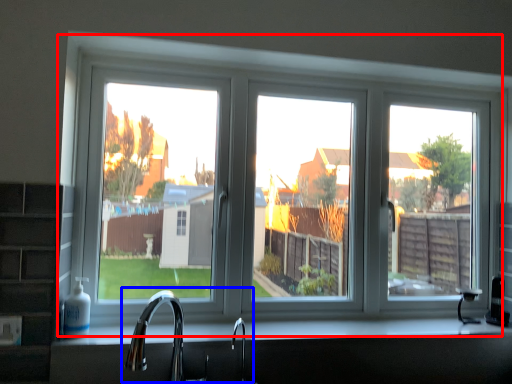
Question: Which object appears farthest to the camera in this image, window (highlighted by a red box) or sink (highlighted by a blue box)?

Choices:
 (A) window
 (B) sink

Answer: (A)